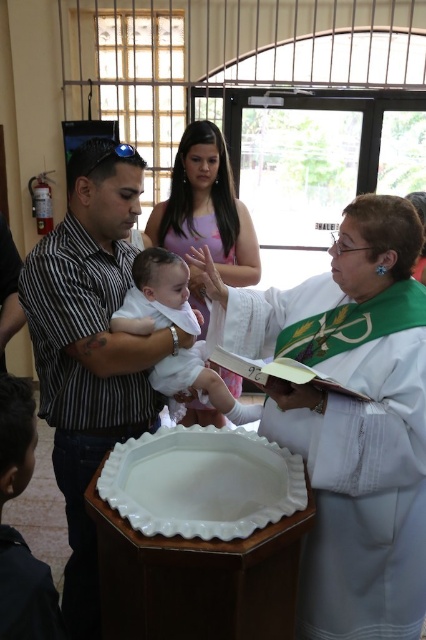
Is point (218, 499) farther from camera compared to point (8, 467)?

Yes, it is.

The height and width of the screenshot is (640, 426). What are the coordinates of `white glossy tray at center` in the screenshot? It's located at (201, 483).

Does point (175, 460) come farther from viewer compared to point (39, 579)?

Yes, it is.

Locate an element on the screen. This screenshot has height=640, width=426. white glossy tray at center is located at coordinates (201, 483).

Does striped shirt at left have a lesser width compared to dark blue fabric at lower left?

Incorrect, striped shirt at left's width is not less than dark blue fabric at lower left's.

Does striped shirt at left appear over dark blue fabric at lower left?

Indeed, striped shirt at left is positioned over dark blue fabric at lower left.

Is point (89, 444) more distant than point (46, 602)?

Yes, point (89, 444) is farther from viewer.

At what (x,y) coordinates should I click in order to perform the action: click on striped shirt at left. Please return your answer as a coordinate pair (x, y). Looking at the image, I should click on (89, 348).

Can you confirm if white cloth at center is positioned to the right of white satin robe at center?

Indeed, white cloth at center is positioned on the right side of white satin robe at center.

Between point (319, 506) and point (195, 291), which one is positioned in front?

Point (319, 506) is more forward.

Identify the location of white cloth at center. (351, 419).